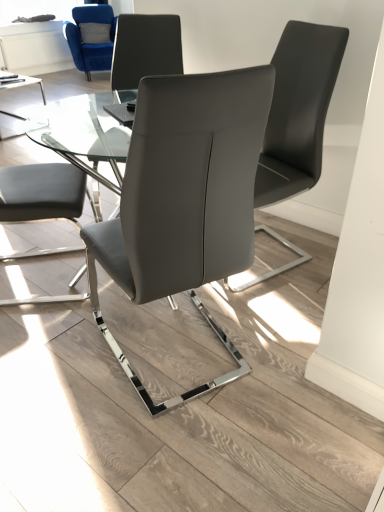
Question: Is matte gray chair at center, arranged as the 2th chair when viewed from the right, located outside transparent glass window screen at upper left?

Choices:
 (A) no
 (B) yes

Answer: (B)

Question: Are matte gray chair at center, the 4th chair when ordered from back to front, and transparent glass window screen at upper left making contact?

Choices:
 (A) yes
 (B) no

Answer: (B)

Question: Is matte gray chair at center, placed as the first chair when sorted from bottom to top, further to the viewer compared to transparent glass window screen at upper left?

Choices:
 (A) yes
 (B) no

Answer: (B)

Question: Does matte gray chair at center, the third chair from the left, have a greater height compared to transparent glass window screen at upper left?

Choices:
 (A) yes
 (B) no

Answer: (A)

Question: Is matte gray chair at center, the fourth chair from the top, positioned before transparent glass window screen at upper left?

Choices:
 (A) no
 (B) yes

Answer: (B)

Question: Is matte gray chair at center, arranged as the first chair when viewed from the front, oriented towards transparent glass window screen at upper left?

Choices:
 (A) yes
 (B) no

Answer: (A)

Question: Is transparent glass window screen at upper left to the left of matte gray chair at center, which is the third chair from right to left, from the viewer's perspective?

Choices:
 (A) yes
 (B) no

Answer: (A)

Question: Would you say transparent glass window screen at upper left contains matte gray chair at center, which is counted as the 3th chair, starting from the front?

Choices:
 (A) no
 (B) yes

Answer: (A)

Question: Is transparent glass window screen at upper left closer to the viewer compared to matte gray chair at center, the second chair from the left?

Choices:
 (A) yes
 (B) no

Answer: (B)

Question: Can you confirm if transparent glass window screen at upper left is wider than matte gray chair at center, marked as the 2th chair in a back-to-front arrangement?

Choices:
 (A) no
 (B) yes

Answer: (A)

Question: Can you confirm if transparent glass window screen at upper left is thinner than matte gray chair at center, the second chair from the top?

Choices:
 (A) no
 (B) yes

Answer: (B)

Question: Is transparent glass window screen at upper left not within matte gray chair at center, the second chair from the left?

Choices:
 (A) yes
 (B) no

Answer: (A)

Question: Is transparent glass table at center not within matte gray chair at center, placed as the 3th chair when sorted from back to front?

Choices:
 (A) no
 (B) yes

Answer: (B)